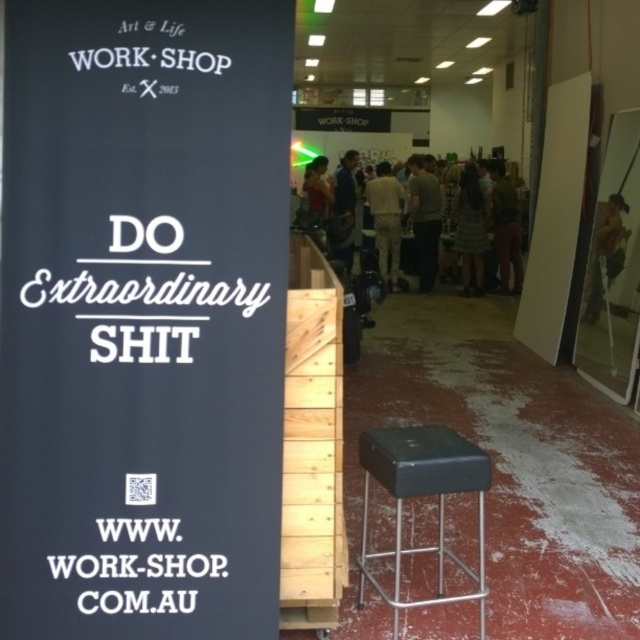
Based on the photo, who is taller, wooden frame at right or green fabric pants at center?

green fabric pants at center

Which is in front, point (620, 211) or point (497, 176)?

Positioned in front is point (620, 211).

The width and height of the screenshot is (640, 640). I want to click on wooden frame at right, so click(x=605, y=252).

Who is more distant from viewer, (444, 429) or (468, 170)?

Point (468, 170)

Between black leather bar stool at lower right and dark gray dress at center, which one is positioned higher?

dark gray dress at center is higher up.

Who is more distant from viewer, (468, 577) or (476, 244)?

Point (476, 244)

This screenshot has width=640, height=640. I want to click on black leather bar stool at lower right, so click(422, 496).

The height and width of the screenshot is (640, 640). Describe the element at coordinates (424, 220) in the screenshot. I see `light brown leather jacket at center` at that location.

Can you confirm if light brown leather jacket at center is positioned above dark gray dress at center?

Yes.

Is point (413, 179) closer to viewer compared to point (481, 260)?

No.

Locate an element on the screen. The height and width of the screenshot is (640, 640). light brown leather jacket at center is located at coordinates (424, 220).